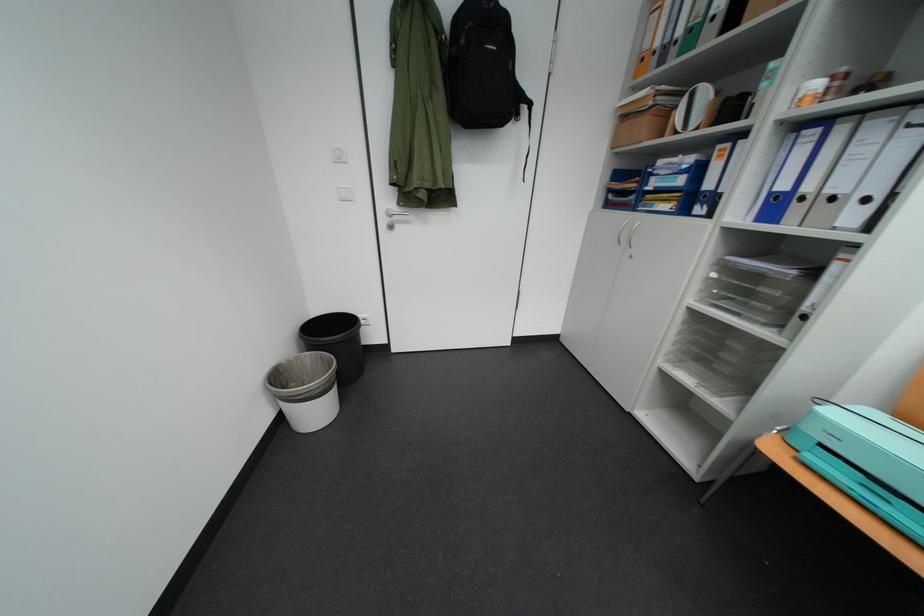
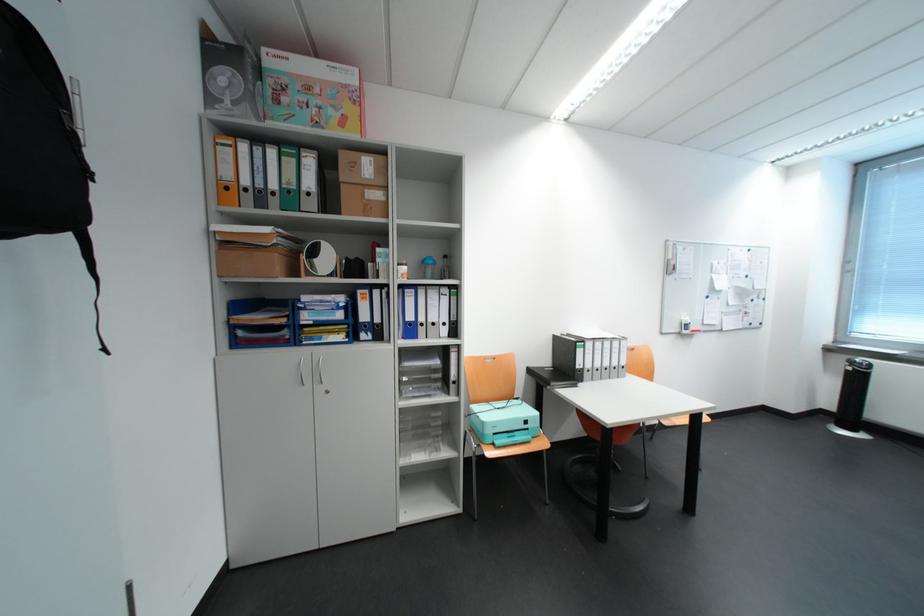
The point at (748,26) is marked in the first image. Where is the corresponding point in the second image?

(351, 215)